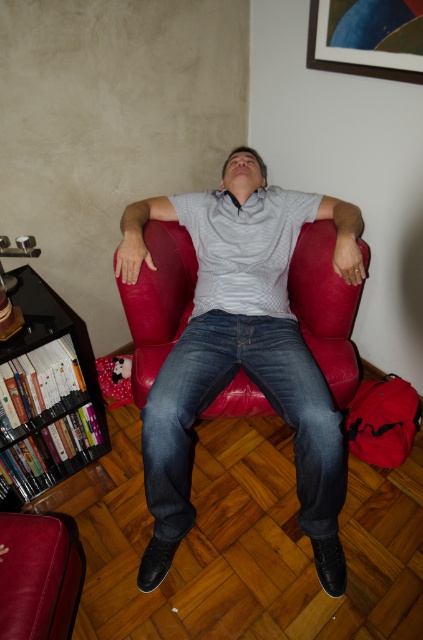
Question: Is denim jeans at center to the left of metallic gold picture frame at upper right from the viewer's perspective?

Choices:
 (A) yes
 (B) no

Answer: (A)

Question: Can you confirm if denim jeans at center is thinner than leather armchair at lower left?

Choices:
 (A) yes
 (B) no

Answer: (B)

Question: Which object is positioned farthest from the gray textured shirt at center?

Choices:
 (A) wooden bookshelf at lower left
 (B) denim jeans at center
 (C) metallic gold picture frame at upper right
 (D) matte gray shirt at center

Answer: (A)

Question: Which point is farther to the camera?

Choices:
 (A) leather armchair at lower left
 (B) denim jeans at center
 (C) matte gray shirt at center
 (D) leather couch at center

Answer: (D)

Question: Does leather couch at center appear on the left side of wooden bookshelf at lower left?

Choices:
 (A) no
 (B) yes

Answer: (A)

Question: Among these points, which one is farthest from the camera?

Choices:
 (A) (164, 300)
 (B) (203, 317)
 (C) (323, 484)
 (D) (214, 196)

Answer: (D)